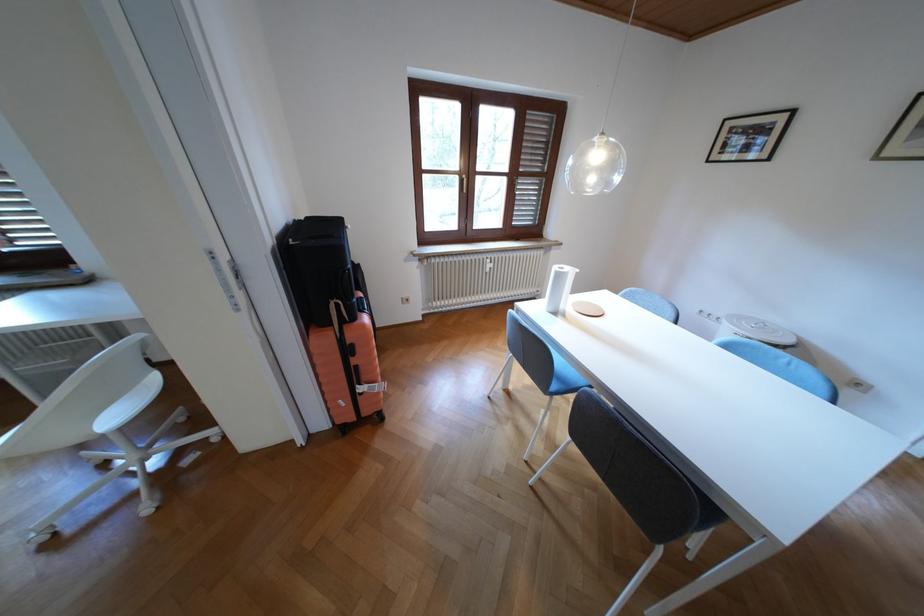
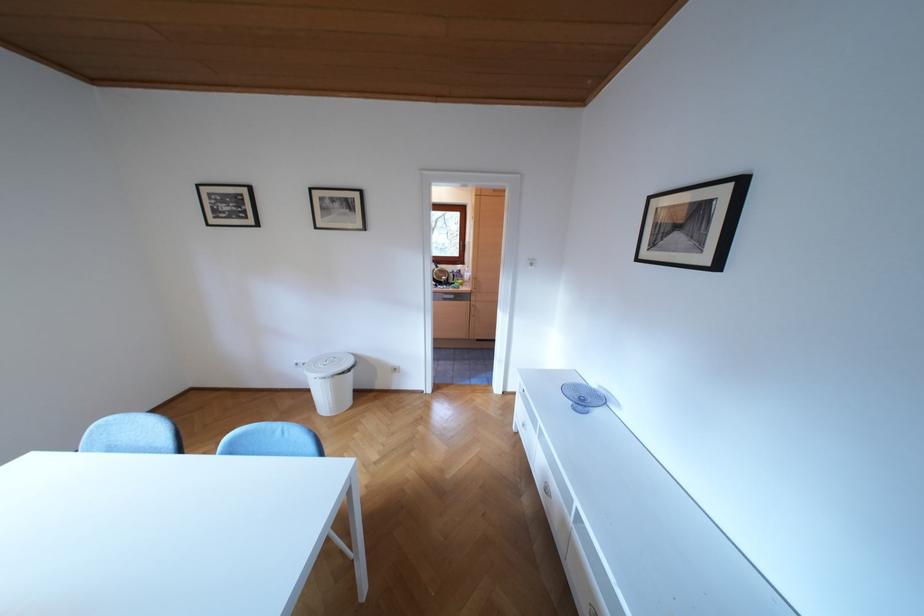
Find the pixel in the second image that matches point 718,161 in the first image.

(219, 225)